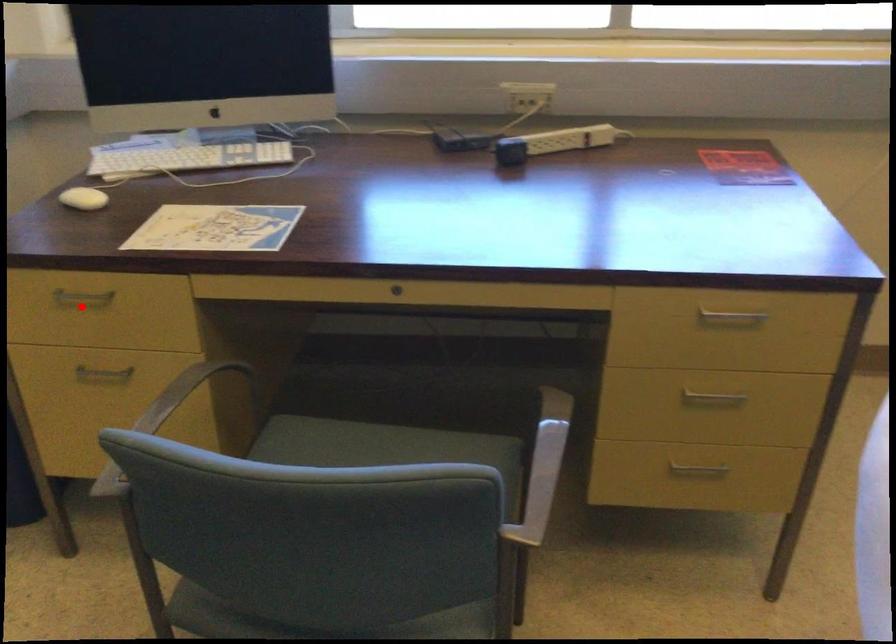
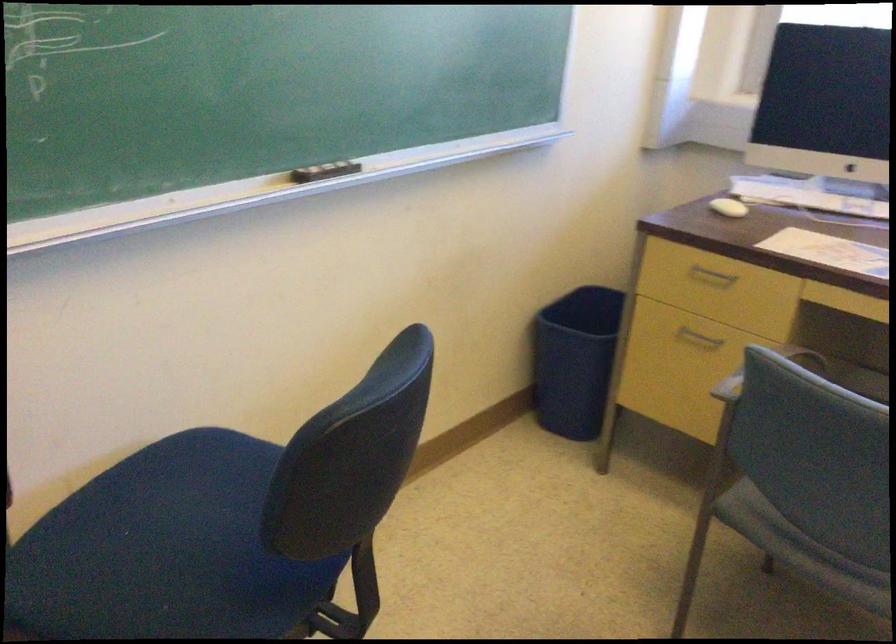
In the second image, find the point that corresponds to the highlighted location in the first image.

(711, 277)